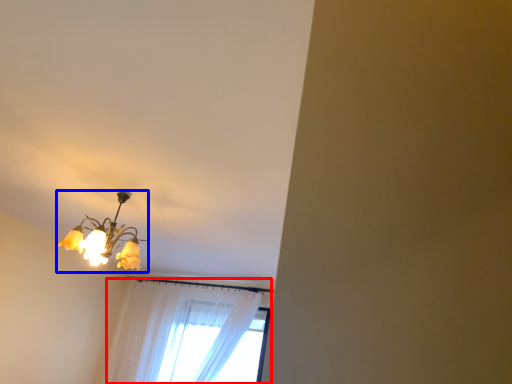
Question: Which object is further to the camera taking this photo, curtain (highlighted by a red box) or lamp (highlighted by a blue box)?

Choices:
 (A) curtain
 (B) lamp

Answer: (A)